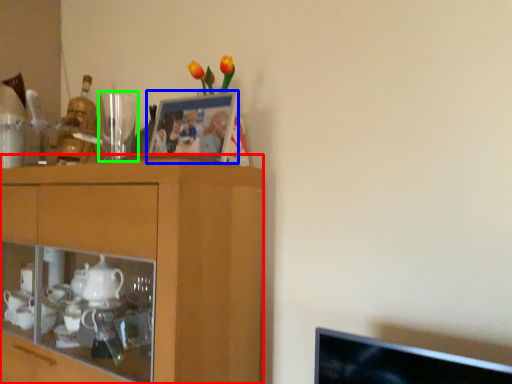
Question: Estimate the real-world distances between objects in this image. Which object is farther from cabinetry (highlighted by a red box), picture frame (highlighted by a blue box) or tableware (highlighted by a green box)?

Choices:
 (A) picture frame
 (B) tableware

Answer: (B)